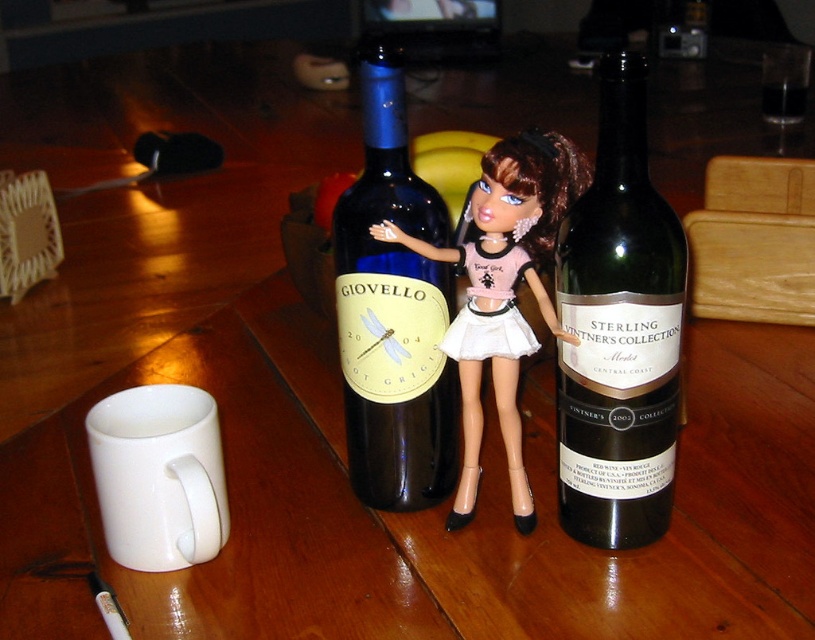
Question: Which of the following is the closest to the observer?

Choices:
 (A) dark green glass bottle at center
 (B) matte black doll at center

Answer: (A)

Question: Is dark green glass bottle at center positioned behind blue glass bottle at center?

Choices:
 (A) yes
 (B) no

Answer: (B)

Question: Which point is closer to the camera?

Choices:
 (A) matte black doll at center
 (B) blue glass bottle at center
 (C) dark green glass bottle at center

Answer: (C)

Question: Observing the image, what is the correct spatial positioning of dark green glass bottle at center in reference to matte black doll at center?

Choices:
 (A) below
 (B) above

Answer: (B)

Question: Among these objects, which one is nearest to the camera?

Choices:
 (A) blue glass bottle at center
 (B) dark green glass bottle at center

Answer: (B)

Question: Is dark green glass bottle at center wider than matte black doll at center?

Choices:
 (A) yes
 (B) no

Answer: (B)